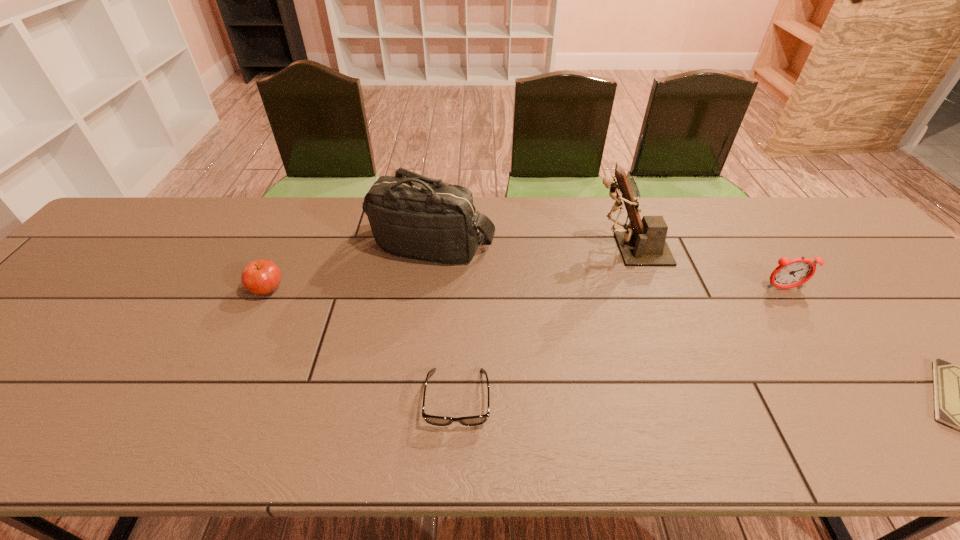
Identify the location of figurine. This screenshot has height=540, width=960. 643,242.

The height and width of the screenshot is (540, 960). In order to click on shoulder bag in this screenshot , I will do `click(412, 216)`.

Locate an element on the screen. alarm clock is located at coordinates (792, 273).

Identify the location of the third tallest object. The width and height of the screenshot is (960, 540). (792, 273).

Locate an element on the screen. The height and width of the screenshot is (540, 960). apple is located at coordinates (261, 277).

Identify the location of the third shortest object. (261, 277).

Image resolution: width=960 pixels, height=540 pixels. What are the coordinates of `spectacles` in the screenshot? It's located at (430, 419).

I want to click on vacant area situated 0.190m on the front-facing side of the figurine, so click(521, 249).

The width and height of the screenshot is (960, 540). I want to click on free space located on the front-facing side of the figurine, so click(x=455, y=249).

Identify the location of free region located on the front-facing side of the figurine. The height and width of the screenshot is (540, 960). (462, 249).